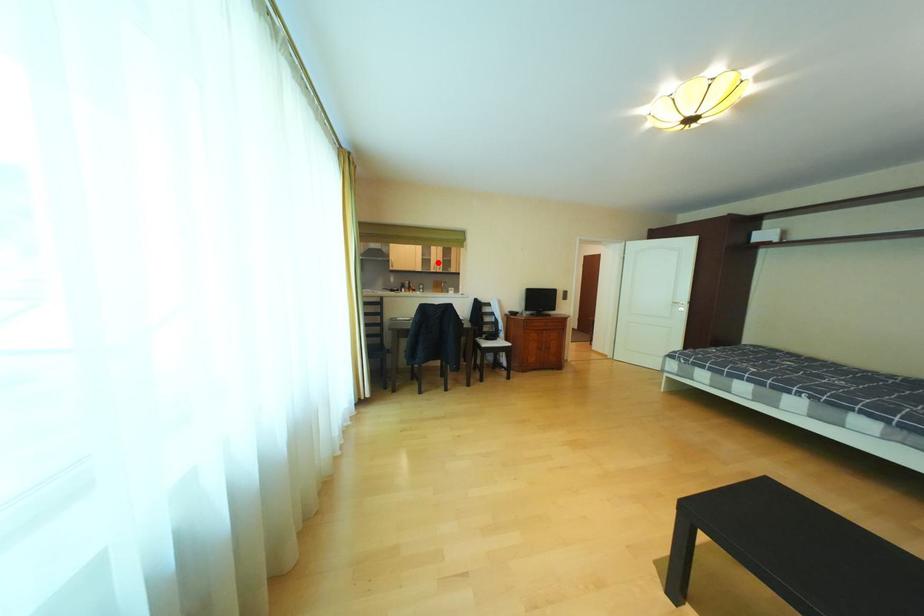
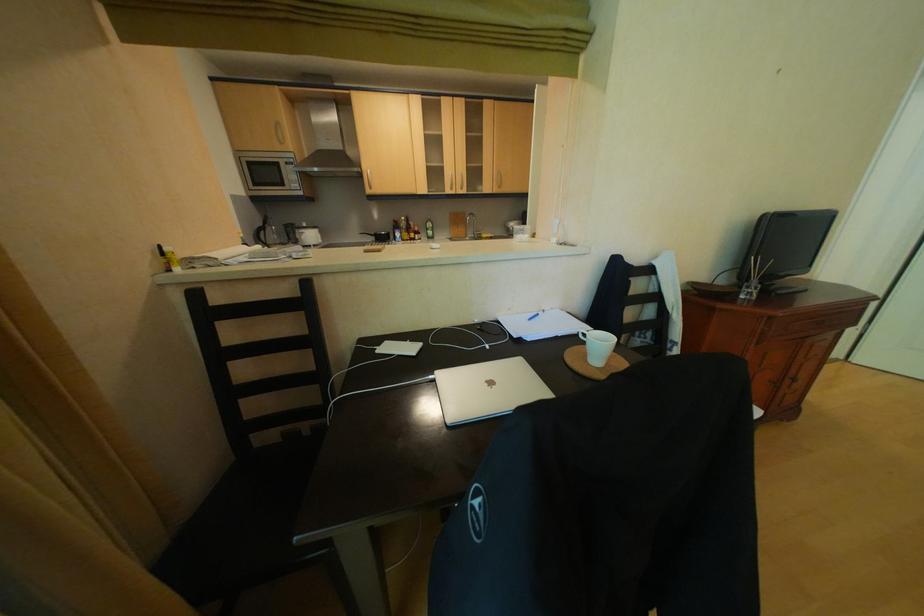
Where in the second image is the point corresponding to the highlighted location from the first image?

(446, 174)